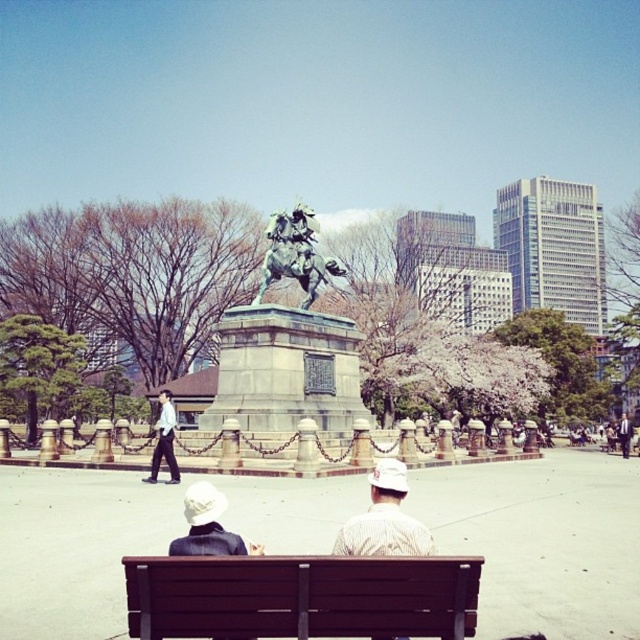
Question: Which object is closer to the camera taking this photo?

Choices:
 (A) light brown fabric shirt at center
 (B) bronze statue at center
 (C) polished bronze statue at center
 (D) brown wooden bench at lower center

Answer: (D)

Question: Which of these objects is positioned farthest from the white shirt at center?

Choices:
 (A) light brown leather jacket at center
 (B) brown wooden bench at lower center
 (C) polished bronze statue at center
 (D) light brown fabric shirt at center

Answer: (A)

Question: Is polished bronze statue at center below white shirt at center?

Choices:
 (A) yes
 (B) no

Answer: (B)

Question: Considering the real-world distances, which object is closest to the brown wooden bench at lower center?

Choices:
 (A) white shirt at center
 (B) light brown fabric shirt at center

Answer: (B)

Question: Considering the relative positions of bronze statue at center and light brown fabric shirt at center in the image provided, where is bronze statue at center located with respect to light brown fabric shirt at center?

Choices:
 (A) right
 (B) left

Answer: (B)

Question: Is bronze statue at center below white shirt at center?

Choices:
 (A) no
 (B) yes

Answer: (A)